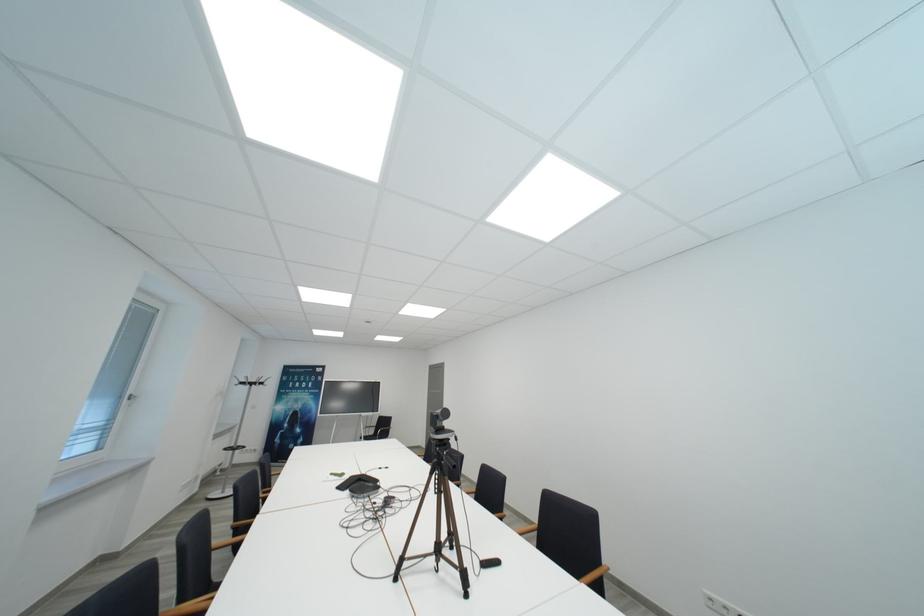
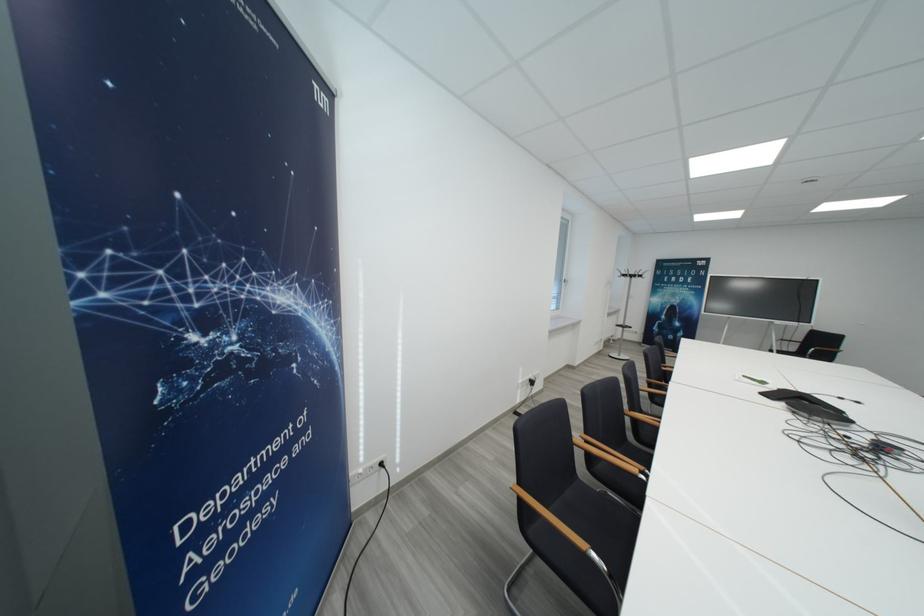
The point at [346,490] is marked in the first image. Where is the corresponding point in the second image?

(770, 397)